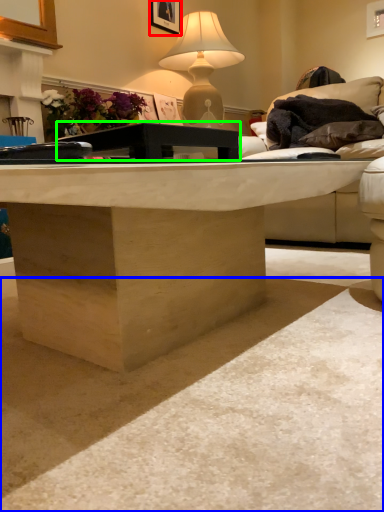
Question: Estimate the real-world distances between objects in this image. Which object is closer to picture frame (highlighted by a red box), concrete (highlighted by a blue box) or table (highlighted by a green box)?

Choices:
 (A) concrete
 (B) table

Answer: (B)